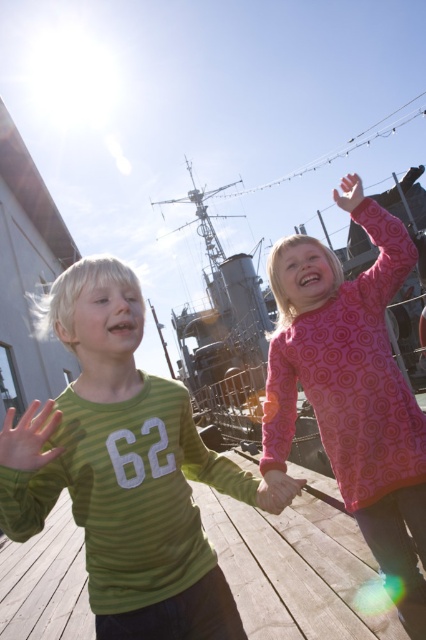
Does green striped shirt at left appear over pink matte hand at center?

No, green striped shirt at left is not above pink matte hand at center.

Can you confirm if green striped shirt at left is thinner than pink matte hand at center?

In fact, green striped shirt at left might be wider than pink matte hand at center.

Between point (138, 544) and point (36, 429), which one is positioned in front?

Point (36, 429)

Locate an element on the screen. green striped shirt at left is located at coordinates (127, 470).

What do you see at coordinates (127, 470) in the screenshot? I see `green striped shirt at left` at bounding box center [127, 470].

Is green striped shirt at left further to camera compared to pink dotted dress at center?

No, green striped shirt at left is closer to the viewer.

Does point (123, 548) come behind point (284, 291)?

No, it is not.

Find the location of `green striped shirt at left`. green striped shirt at left is located at coordinates (127, 470).

Which is below, wooden at center or pink matte hand at upper right?

Positioned lower is wooden at center.

The image size is (426, 640). Find the location of `wooden at center`. wooden at center is located at coordinates (294, 568).